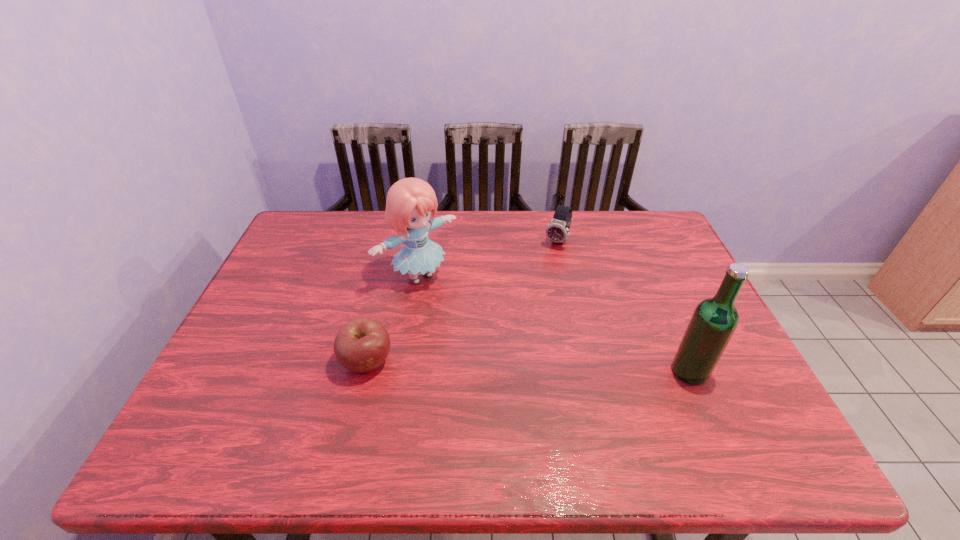
Identify the location of vacant space on the desktop that is between the apple and the beer bottle and is positioned on the face of the farthest object. (486, 365).

At what (x,y) coordinates should I click in order to perform the action: click on free space on the desktop that is between the apple and the beer bottle and is positioned on the front-facing side of the doll. Please return your answer as a coordinate pair (x, y). Image resolution: width=960 pixels, height=540 pixels. Looking at the image, I should click on (520, 366).